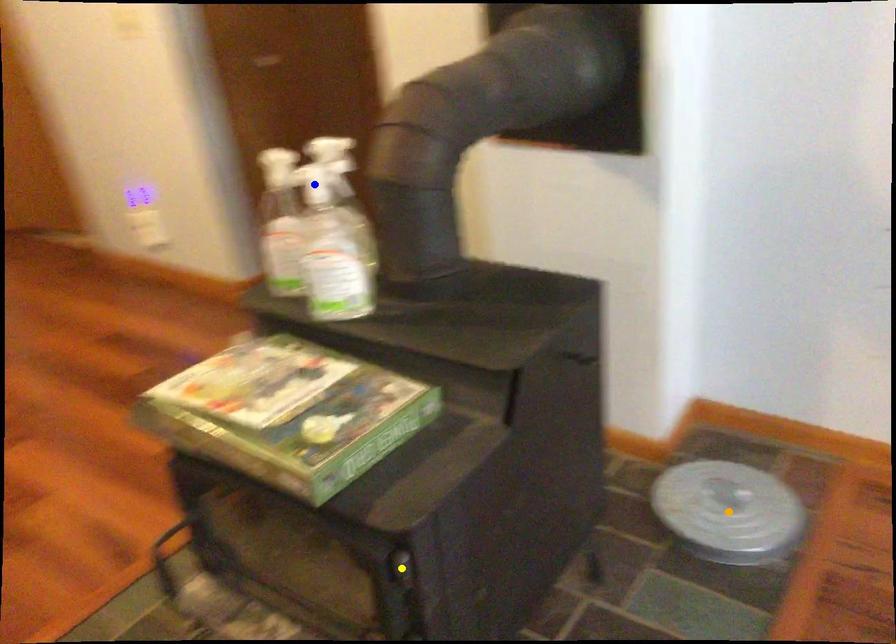
Order these from nearest to farthest:
- blue point
- orange point
- yellow point

yellow point, blue point, orange point